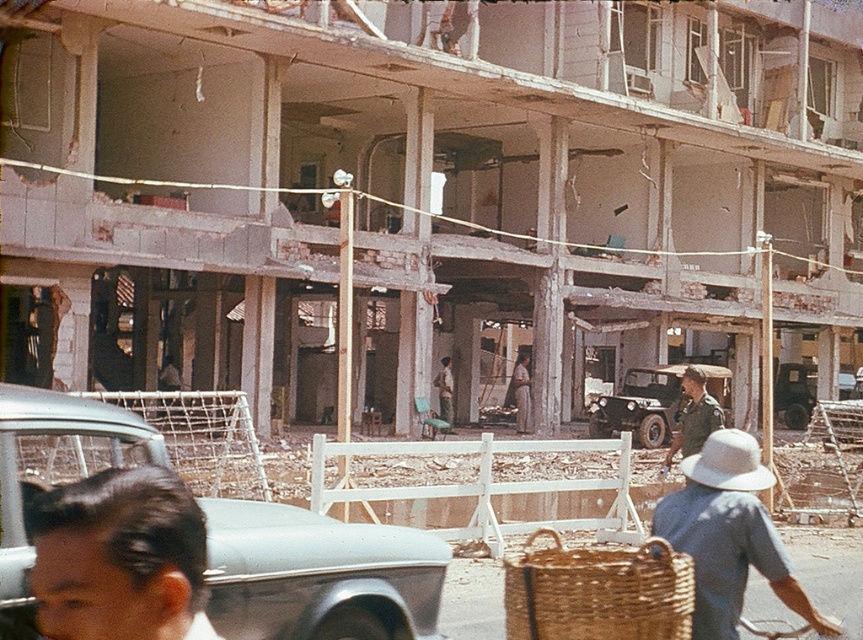
Is white straw hat at lower right below green matte jeep at center?

Incorrect, white straw hat at lower right is not positioned below green matte jeep at center.

Is point (706, 625) closer to viewer compared to point (681, 388)?

Yes, point (706, 625) is closer to viewer.

The width and height of the screenshot is (863, 640). In order to click on white straw hat at lower right in this screenshot , I will do `click(729, 534)`.

Who is positioned more to the left, white straw hat at lower right or camouflage uniform at center?

white straw hat at lower right

Which of these two, white straw hat at lower right or camouflage uniform at center, stands shorter?

→ white straw hat at lower right is shorter.

Is point (761, 561) farther from viewer compared to point (697, 381)?

No, it is in front of (697, 381).

Locate an element on the screen. The width and height of the screenshot is (863, 640). white straw hat at lower right is located at coordinates (729, 534).

Between silver metallic car at center and light brown fabric dress at center, which one has less height?

silver metallic car at center is shorter.

Does silver metallic car at center appear over light brown fabric dress at center?

Indeed, silver metallic car at center is positioned over light brown fabric dress at center.

Is point (213, 556) farther from camera compared to point (518, 380)?

No, it is not.

At what (x,y) coordinates should I click in order to perform the action: click on silver metallic car at center. Please return your answer as a coordinate pair (x, y). Looking at the image, I should click on (318, 573).